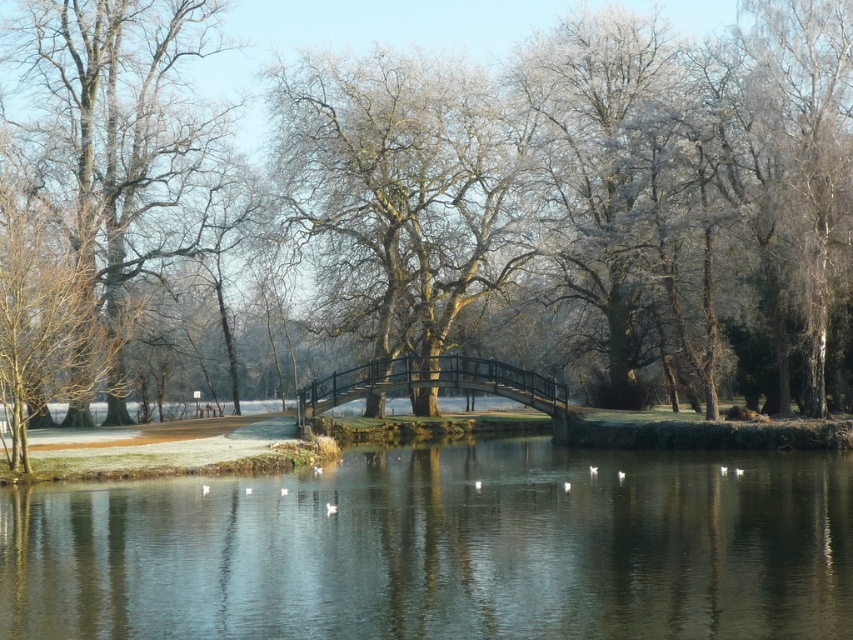
You are standing at the edge of the scene and want to walk towards the transparent glass lake at center and the frosty bark tree at center. Which object will you reach first?

You will reach the transparent glass lake at center first because it is closer to you than the frosty bark tree at center.

You are an architect designing a new park and want to incorporate elements from this winter scene. If you want to emphasize the frosty bark tree at center in your design, how does its size compare to the black metal bridge at center in the original image?

→ The frosty bark tree at center is larger in size compared to the black metal bridge at center in the original image.